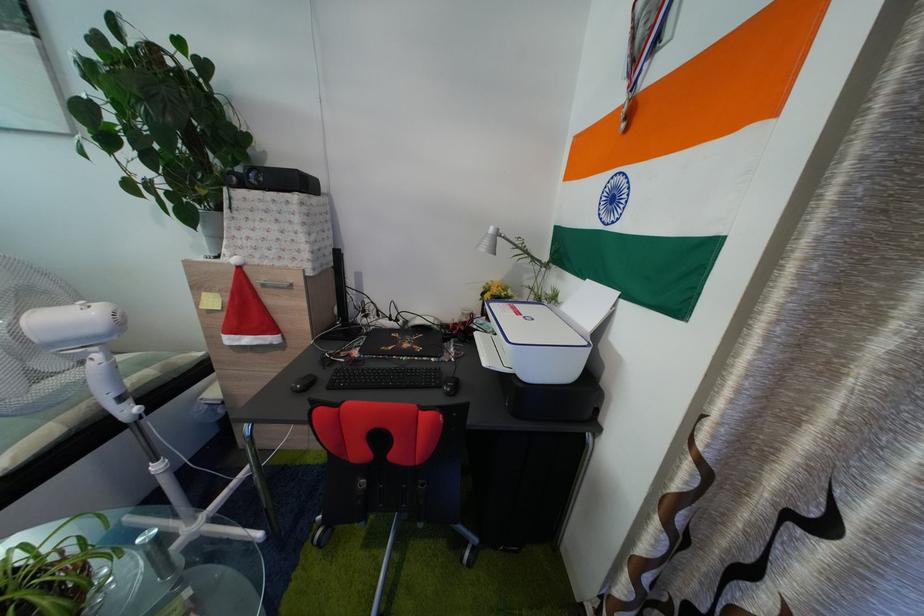
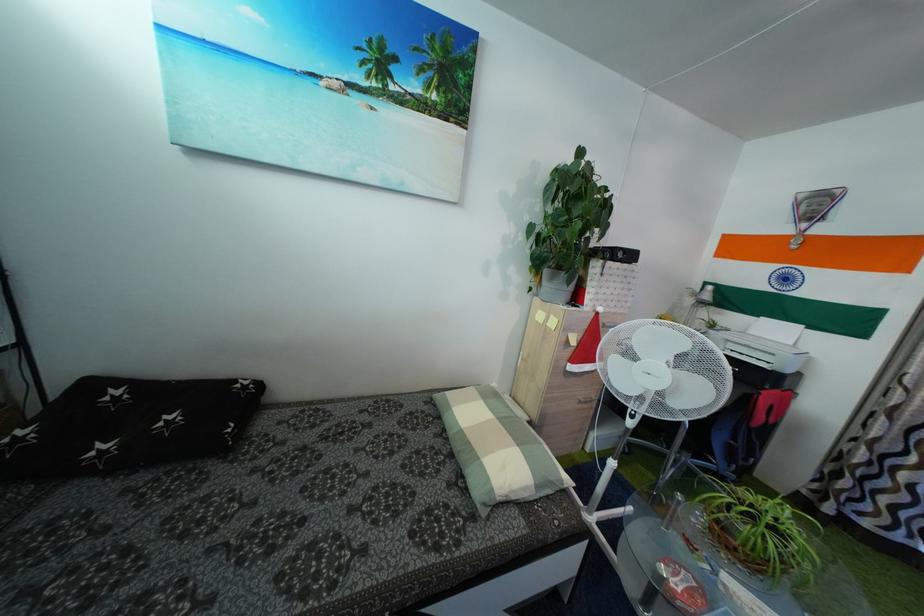
Question: The images are taken continuously from a first-person perspective. In which direction are you moving?

Choices:
 (A) Left
 (B) Right
 (C) Forward
 (D) Backward

Answer: (A)